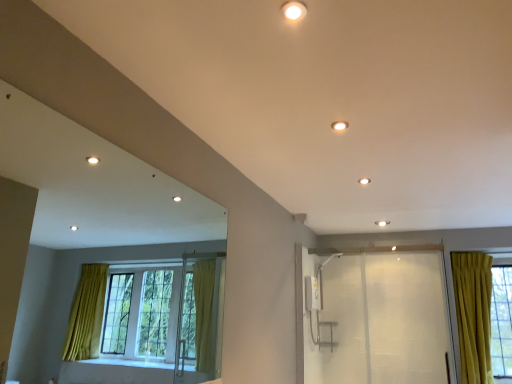
In order to click on matte white light fixture at upper center, which is counted as the 2th lighting, starting from the right in this screenshot , I will do `click(294, 10)`.

What do you see at coordinates (340, 125) in the screenshot?
I see `matte white light fixture at upper center, the second lighting in the top-to-bottom sequence` at bounding box center [340, 125].

I want to click on matte white light fixture at upper center, placed as the second lighting when sorted from back to front, so click(294, 10).

Consider the image. In the image, is matte white light fixture at upper center, placed as the 1th lighting when sorted from left to right, positioned in front of or behind transparent plastic screen door at right?

Clearly, matte white light fixture at upper center, placed as the 1th lighting when sorted from left to right, is in front of transparent plastic screen door at right.

Considering the sizes of objects matte white light fixture at upper center, which is counted as the 2th lighting, starting from the right, and transparent plastic screen door at right in the image provided, who is bigger, matte white light fixture at upper center, which is counted as the 2th lighting, starting from the right, or transparent plastic screen door at right?

transparent plastic screen door at right.

Is matte white light fixture at upper center, marked as the first lighting in a top-to-bottom arrangement, taller than transparent plastic screen door at right?

No, matte white light fixture at upper center, marked as the first lighting in a top-to-bottom arrangement, is not taller than transparent plastic screen door at right.

I want to click on the 2nd lighting in front of the transparent plastic screen door at right, starting your count from the anchor, so click(294, 10).

Which object is positioned more to the right, matte white light fixture at upper center, which is the first lighting from back to front, or transparent plastic screen door at right?

From the viewer's perspective, transparent plastic screen door at right appears more on the right side.

From the picture: Could you tell me if matte white light fixture at upper center, the first lighting from the right, is turned towards transparent plastic screen door at right?

No, matte white light fixture at upper center, the first lighting from the right, does not turn towards transparent plastic screen door at right.

Does matte white light fixture at upper center, marked as the 2th lighting in a left-to-right arrangement, have a greater height compared to transparent plastic screen door at right?

Incorrect, the height of matte white light fixture at upper center, marked as the 2th lighting in a left-to-right arrangement, is not larger of that of transparent plastic screen door at right.

The width and height of the screenshot is (512, 384). Find the location of `screen door beneath the matte white light fixture at upper center, which appears as the 1th lighting when ordered from the bottom (from a real-world perspective)`. screen door beneath the matte white light fixture at upper center, which appears as the 1th lighting when ordered from the bottom (from a real-world perspective) is located at coordinates (373, 316).

Who is bigger, transparent plastic screen door at right or matte white light fixture at upper center, marked as the 2th lighting in a left-to-right arrangement?

transparent plastic screen door at right is bigger.

How many degrees apart are the facing directions of transparent plastic screen door at right and matte white light fixture at upper center, which is counted as the 2th lighting, starting from the front?

The facing directions of transparent plastic screen door at right and matte white light fixture at upper center, which is counted as the 2th lighting, starting from the front, are 169 degrees apart.

Considering the points (319, 313) and (343, 127), which point is behind, point (319, 313) or point (343, 127)?

Positioned behind is point (319, 313).

Consider the image. Is transparent plastic screen door at right outside of matte white light fixture at upper center, marked as the 2th lighting in a left-to-right arrangement?

Absolutely, transparent plastic screen door at right is external to matte white light fixture at upper center, marked as the 2th lighting in a left-to-right arrangement.

Between matte white light fixture at upper center, which appears as the 1th lighting when ordered from the bottom, and matte white light fixture at upper center, marked as the first lighting in a top-to-bottom arrangement, which one has smaller width?

matte white light fixture at upper center, which appears as the 1th lighting when ordered from the bottom, is thinner.

From the image's perspective, which one is positioned lower, matte white light fixture at upper center, marked as the 2th lighting in a left-to-right arrangement, or matte white light fixture at upper center, the 1th lighting when ordered from front to back?

From the image's view, matte white light fixture at upper center, marked as the 2th lighting in a left-to-right arrangement, is below.

Is point (344, 128) closer to viewer compared to point (295, 19)?

No, (344, 128) is behind (295, 19).

Image resolution: width=512 pixels, height=384 pixels. In the image, there is a matte white light fixture at upper center, the first lighting from the right. Identify the location of lighting below it (from a real-world perspective). (294, 10).

Is transparent plastic screen door at right taller than matte white light fixture at upper center, marked as the first lighting in a top-to-bottom arrangement?

Yes.

From the image's perspective, relative to matte white light fixture at upper center, the 2th lighting when ordered from bottom to top, is transparent plastic screen door at right above or below?

Result: Clearly, from the image's perspective, transparent plastic screen door at right is below matte white light fixture at upper center, the 2th lighting when ordered from bottom to top.

Measure the distance between transparent plastic screen door at right and matte white light fixture at upper center, which is counted as the 2th lighting, starting from the right.

transparent plastic screen door at right and matte white light fixture at upper center, which is counted as the 2th lighting, starting from the right, are 3.33 meters apart.

From a real-world perspective, which object rests below the other?

In real-world perspective, transparent plastic screen door at right is lower.

Which object is wider, matte white light fixture at upper center, marked as the first lighting in a top-to-bottom arrangement, or matte white light fixture at upper center, the second lighting in the top-to-bottom sequence?

matte white light fixture at upper center, marked as the first lighting in a top-to-bottom arrangement, is wider.

Is matte white light fixture at upper center, placed as the second lighting when sorted from back to front, surrounding matte white light fixture at upper center, which is the first lighting from back to front?

No, matte white light fixture at upper center, which is the first lighting from back to front, is not a part of matte white light fixture at upper center, placed as the second lighting when sorted from back to front.

Looking at this image, from a real-world perspective, is matte white light fixture at upper center, which is counted as the 2th lighting, starting from the right, physically below matte white light fixture at upper center, marked as the 2th lighting in a left-to-right arrangement?

Correct, in the physical world, matte white light fixture at upper center, which is counted as the 2th lighting, starting from the right, is lower than matte white light fixture at upper center, marked as the 2th lighting in a left-to-right arrangement.

Where is `the 1st lighting positioned above the transparent plastic screen door at right (from a real-world perspective)`? Image resolution: width=512 pixels, height=384 pixels. the 1st lighting positioned above the transparent plastic screen door at right (from a real-world perspective) is located at coordinates (294, 10).

This screenshot has width=512, height=384. I want to click on screen door below the matte white light fixture at upper center, which is counted as the 2th lighting, starting from the front (from the image's perspective), so point(373,316).

Based on their spatial positions, is matte white light fixture at upper center, marked as the first lighting in a top-to-bottom arrangement, or transparent plastic screen door at right further from matte white light fixture at upper center, which appears as the 1th lighting when ordered from the bottom?

transparent plastic screen door at right lies further to matte white light fixture at upper center, which appears as the 1th lighting when ordered from the bottom, than the other object.

Based on their spatial positions, is matte white light fixture at upper center, which appears as the 1th lighting when ordered from the bottom, or matte white light fixture at upper center, the 2th lighting when ordered from bottom to top, closer to transparent plastic screen door at right?

Among the two, matte white light fixture at upper center, which appears as the 1th lighting when ordered from the bottom, is located nearer to transparent plastic screen door at right.

Looking at the image, which one is located further to matte white light fixture at upper center, which is the first lighting from back to front, transparent plastic screen door at right or matte white light fixture at upper center, the 1th lighting when ordered from front to back?

transparent plastic screen door at right is further to matte white light fixture at upper center, which is the first lighting from back to front.

Looking at the image, which one is located further to transparent plastic screen door at right, matte white light fixture at upper center, placed as the 1th lighting when sorted from left to right, or matte white light fixture at upper center, which appears as the 1th lighting when ordered from the bottom?

matte white light fixture at upper center, placed as the 1th lighting when sorted from left to right, is positioned further to the anchor transparent plastic screen door at right.

Estimate the real-world distances between objects in this image. Which object is further from matte white light fixture at upper center, which is counted as the 2th lighting, starting from the right, transparent plastic screen door at right or matte white light fixture at upper center, which is the first lighting from back to front?

Based on the image, transparent plastic screen door at right appears to be further to matte white light fixture at upper center, which is counted as the 2th lighting, starting from the right.

Based on their spatial positions, is matte white light fixture at upper center, the second lighting in the top-to-bottom sequence, or transparent plastic screen door at right closer to matte white light fixture at upper center, marked as the first lighting in a top-to-bottom arrangement?

matte white light fixture at upper center, the second lighting in the top-to-bottom sequence, is positioned closer to the anchor matte white light fixture at upper center, marked as the first lighting in a top-to-bottom arrangement.

Image resolution: width=512 pixels, height=384 pixels. I want to click on lighting between matte white light fixture at upper center, placed as the 1th lighting when sorted from left to right, and transparent plastic screen door at right in the front-back direction, so click(x=340, y=125).